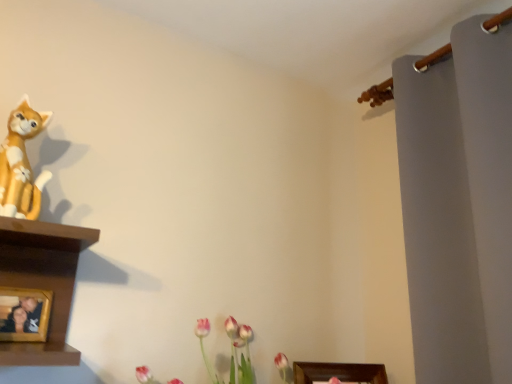
Question: In terms of height, does matte orange cat at left look taller or shorter compared to wooden photo frame at lower left?

Choices:
 (A) tall
 (B) short

Answer: (A)

Question: Looking at their shapes, would you say matte orange cat at left is wider or thinner than wooden photo frame at lower left?

Choices:
 (A) thin
 (B) wide

Answer: (B)

Question: From a real-world perspective, is matte orange cat at left above or below wooden photo frame at lower left?

Choices:
 (A) above
 (B) below

Answer: (A)

Question: From the image's perspective, relative to matte orange cat at left, is wooden photo frame at lower left above or below?

Choices:
 (A) above
 (B) below

Answer: (B)

Question: In the image, is wooden photo frame at lower left positioned in front of or behind matte orange cat at left?

Choices:
 (A) front
 (B) behind

Answer: (B)

Question: Choose the correct answer: Is wooden photo frame at lower left inside matte orange cat at left or outside it?

Choices:
 (A) outside
 (B) inside

Answer: (A)

Question: Would you say wooden photo frame at lower left is to the left or to the right of matte orange cat at left in the picture?

Choices:
 (A) left
 (B) right

Answer: (A)